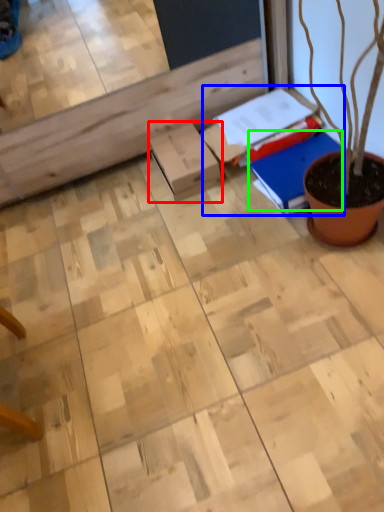
Question: Which is farther away from cardboard box (highlighted by a red box)? book (highlighted by a blue box) or notebook (highlighted by a green box)?

Choices:
 (A) book
 (B) notebook

Answer: (B)